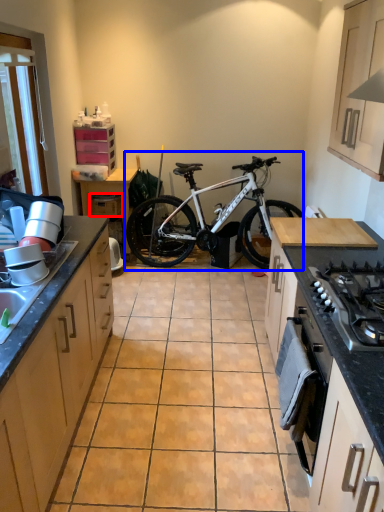
Question: Which object appears closest to the camera in this image, drawer (highlighted by a red box) or bicycle (highlighted by a blue box)?

Choices:
 (A) drawer
 (B) bicycle

Answer: (B)